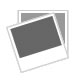
Locate an element on the screen. Image resolution: width=80 pixels, height=80 pixels. light is located at coordinates (21, 10).